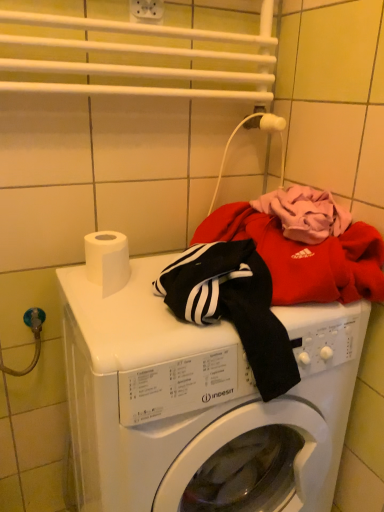
Locate an element on the screen. This screenshot has width=384, height=512. free point to the right of white matte toilet paper at top left is located at coordinates (156, 292).